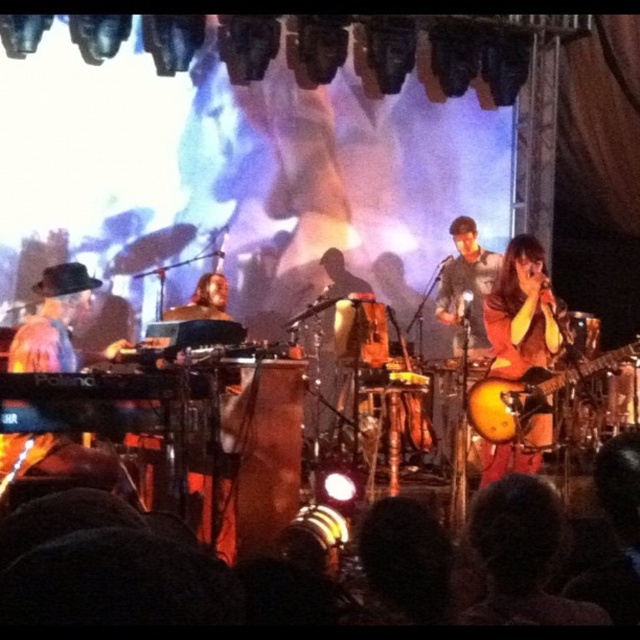
You are a stagehand who needs to place a microphone stand at the exact center of the stage. The stage is a rectangle with its bottom edge aligned with the keyboardist and its top edge at the large screen. The glossy wood guitar at right is located at point (531, 400). Where should you place the microphone stand?

The microphone stand should be placed at the center point of the stage, which can be calculated by finding the midpoint between the bottom edge aligned with the keyboardist and the top edge at the large screen. Since the glossy wood guitar at right is located at point (531, 400), this coordinate can help determine the stage boundaries for accurate placement.

You are a stagehand who needs to adjust the microphone stand between the shiny gold guitar at right and the gray fabric shirt at center. The stand requires at least 4 feet of space to be placed safely. Can you fit it between them?

The shiny gold guitar at right is 3.95 feet away from the gray fabric shirt at center, which is less than the required 4 feet. Therefore, the microphone stand cannot be safely placed between them.

You are a stagehand who needs to place a 1.2 meter tall amplifier between the shiny gold guitar at right and the glossy wood guitar at right. Can you fit it there?

The shiny gold guitar at right is taller than the glossy wood guitar at right, but the height of the guitars does not affect the horizontal space between them. The amplifier can be placed between them if there is enough horizontal space, but the description does not provide information about the distance between the guitars. Therefore, it is uncertain whether the amplifier will fit.